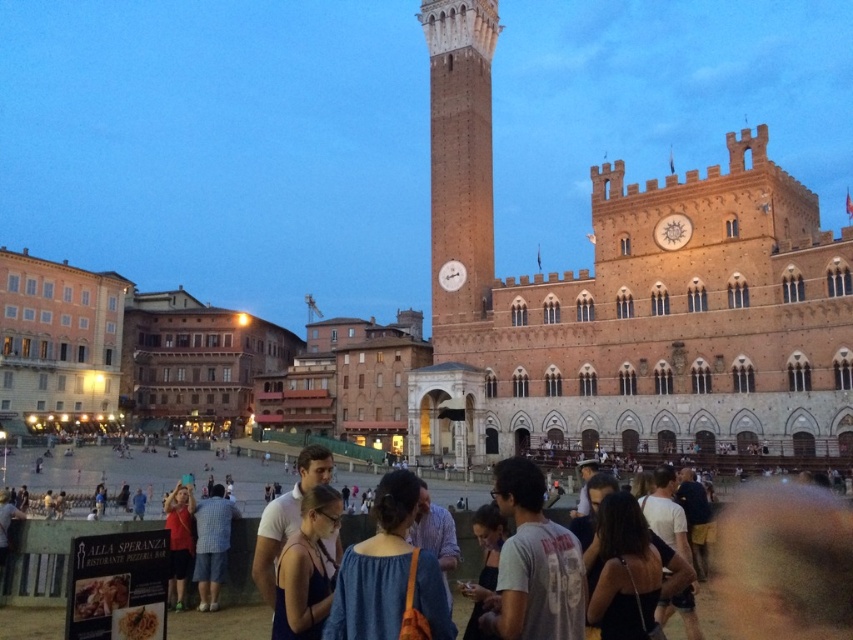
Is brown stone tower at center to the right of dark blue fabric crowd at lower center from the viewer's perspective?

Indeed, brown stone tower at center is positioned on the right side of dark blue fabric crowd at lower center.

Is brown stone tower at center below dark blue fabric crowd at lower center?

Incorrect, brown stone tower at center is not positioned below dark blue fabric crowd at lower center.

The image size is (853, 640). What do you see at coordinates (627, 300) in the screenshot? I see `brown stone tower at center` at bounding box center [627, 300].

Locate an element on the screen. The width and height of the screenshot is (853, 640). brown stone tower at center is located at coordinates click(x=627, y=300).

Consider the image. Is brown stone tower at center to the left of gray cotton t-shirt at center from the viewer's perspective?

Incorrect, brown stone tower at center is not on the left side of gray cotton t-shirt at center.

Can you confirm if brown stone tower at center is positioned to the right of gray cotton t-shirt at center?

Indeed, brown stone tower at center is positioned on the right side of gray cotton t-shirt at center.

Does point (735, 385) come closer to viewer compared to point (527, 636)?

That is False.

The image size is (853, 640). I want to click on brown stone tower at center, so click(627, 300).

Is dark blue fabric crowd at lower center wider than gray cotton t-shirt at center?

Yes.

Between dark blue fabric crowd at lower center and gray cotton t-shirt at center, which one is positioned higher?

gray cotton t-shirt at center is higher up.

Which is behind, point (339, 472) or point (531, 531)?

Point (339, 472)

Find the location of a particular element. The width and height of the screenshot is (853, 640). dark blue fabric crowd at lower center is located at coordinates (50, 556).